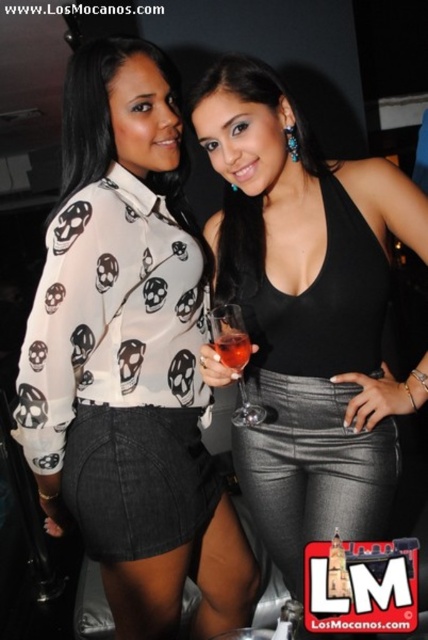
Question: Does white sheer blouse at upper left have a larger size compared to translucent glass wine glass at center?

Choices:
 (A) no
 (B) yes

Answer: (B)

Question: Among these objects, which one is nearest to the camera?

Choices:
 (A) shiny silver pants at center
 (B) translucent glass wine glass at center
 (C) white sheer blouse at upper left

Answer: (B)

Question: Which object appears closest to the camera in this image?

Choices:
 (A) shiny silver pants at center
 (B) translucent glass wine glass at center
 (C) translucent glass at center
 (D) white sheer blouse at upper left

Answer: (B)

Question: Based on their relative distances, which object is nearer to the shiny silver pants at center?

Choices:
 (A) white sheer blouse at upper left
 (B) translucent glass at center

Answer: (A)

Question: Is shiny silver pants at center to the right of translucent glass at center from the viewer's perspective?

Choices:
 (A) no
 (B) yes

Answer: (B)

Question: Does white sheer blouse at upper left appear under shiny silver pants at center?

Choices:
 (A) no
 (B) yes

Answer: (B)